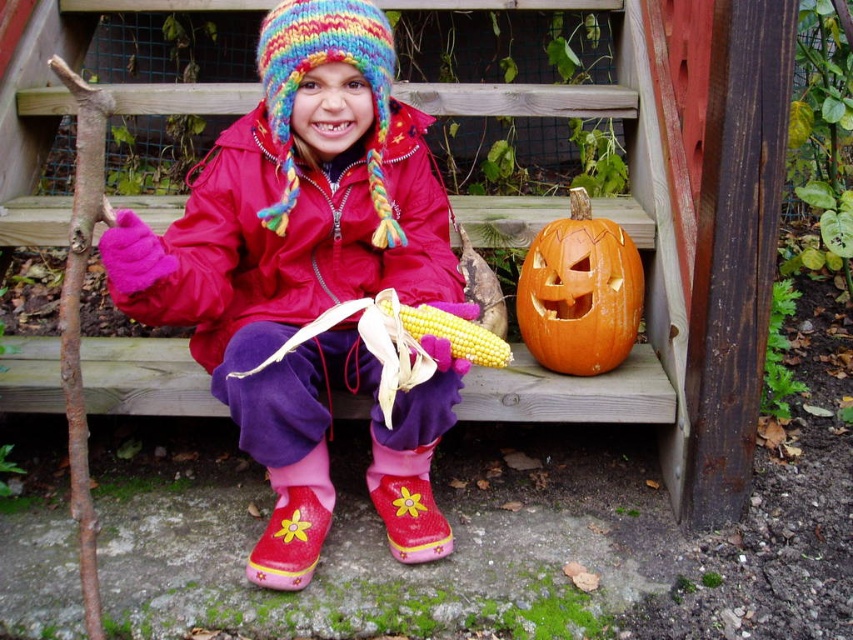
Between matte pink rubber boots at center and orange matte pumpkin at lower right, which one is positioned higher?

orange matte pumpkin at lower right

Between matte pink rubber boots at center and orange matte pumpkin at lower right, which one is positioned lower?

matte pink rubber boots at center is below.

I want to click on matte pink rubber boots at center, so click(296, 253).